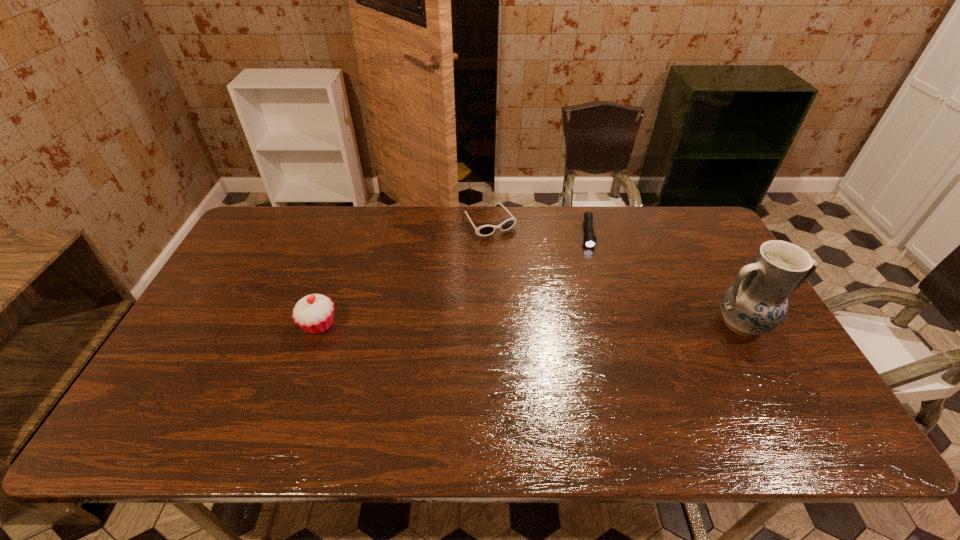
Where is `vacant area that lies between the leftmost object and the second object from right to left`? This screenshot has width=960, height=540. vacant area that lies between the leftmost object and the second object from right to left is located at coordinates (453, 279).

At what (x,y) coordinates should I click in order to perform the action: click on unoccupied position between the pottery and the leftmost object. Please return your answer as a coordinate pair (x, y). Looking at the image, I should click on (531, 324).

This screenshot has height=540, width=960. In order to click on empty space between the rightmost object and the leftmost object in this screenshot , I will do `click(531, 324)`.

Find the location of a particular element. The width and height of the screenshot is (960, 540). empty space that is in between the tallest object and the third tallest object is located at coordinates (616, 273).

This screenshot has height=540, width=960. In order to click on vacant region between the shortest object and the second tallest object in this screenshot , I will do `click(453, 279)`.

Identify the location of unoccupied position between the rightmost object and the shortest object. (665, 279).

Locate an element on the screen. The height and width of the screenshot is (540, 960). free space between the pottery and the second tallest object is located at coordinates (531, 324).

Select which object is the third closest to the second object from left to right. Please provide its 2D coordinates. Your answer should be formatted as a tuple, i.e. [(x, y)], where the tuple contains the x and y coordinates of a point satisfying the conditions above.

[(756, 303)]

At what (x,y) coordinates should I click in order to perform the action: click on object that ranks as the closest to the leftmost object. Please return your answer as a coordinate pair (x, y). Image resolution: width=960 pixels, height=540 pixels. Looking at the image, I should click on (485, 230).

In order to click on vacant space that satisfies the following two spatial constraints: 1. on the back side of the leftmost object; 2. on the left side of the pottery in this screenshot , I will do `click(319, 324)`.